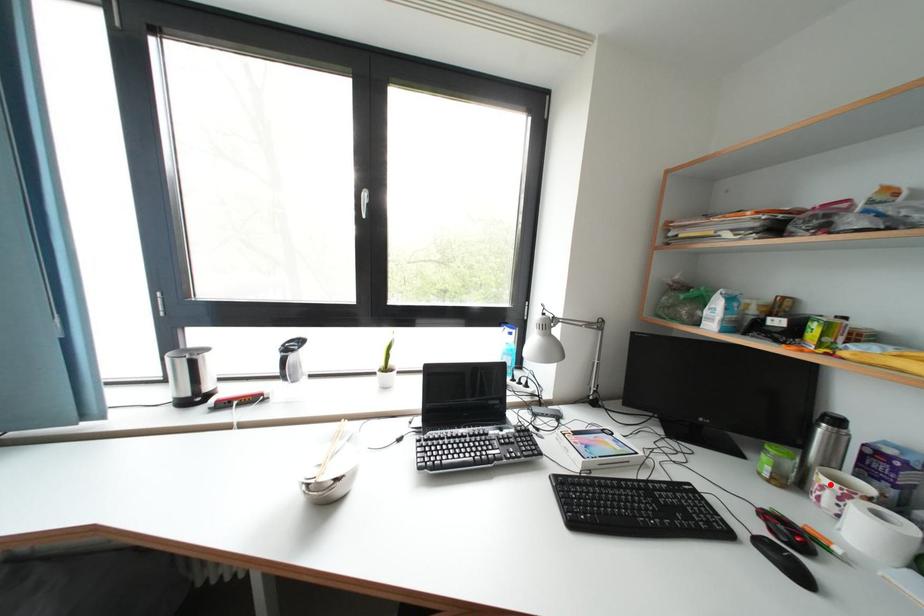
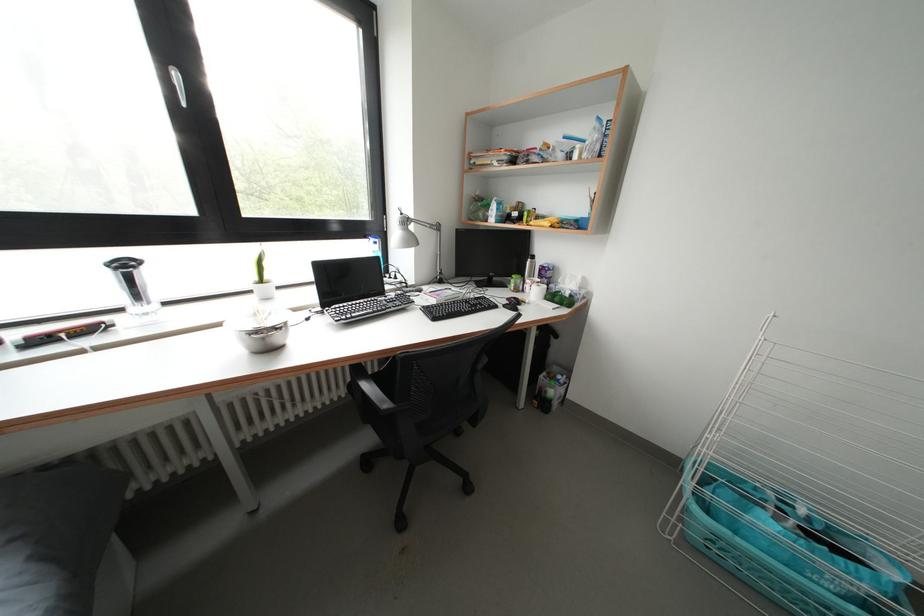
Where in the second image is the point corresponding to the highlighted location from the first image?

(535, 286)